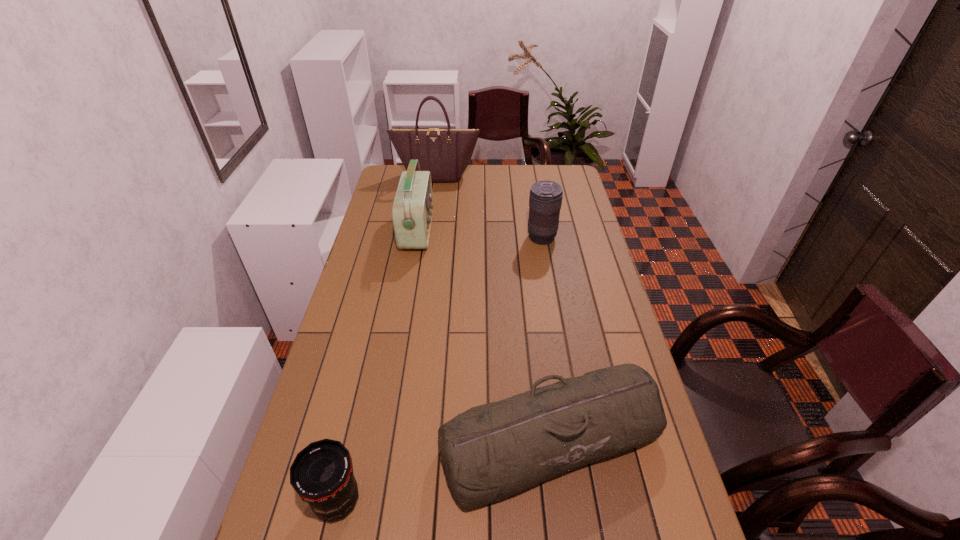
The height and width of the screenshot is (540, 960). I want to click on duffel bag situated at the right edge, so click(492, 451).

Where is `object that is at the far left corner`? The width and height of the screenshot is (960, 540). object that is at the far left corner is located at coordinates (446, 153).

In order to click on free space at the far edge in this screenshot , I will do `click(531, 168)`.

The image size is (960, 540). In the image, there is a desktop. In order to click on free region at the left edge in this screenshot , I will do `click(359, 271)`.

At what (x,y) coordinates should I click in order to perform the action: click on vacant space at the right edge. Please return your answer as a coordinate pair (x, y). This screenshot has width=960, height=540. Looking at the image, I should click on tap(627, 492).

You are a GUI agent. You are given a task and a screenshot of the screen. Output one action in this format:
    pyautogui.click(x=<x>, y=<y>)
    Task: Click on the vacant space at the far left corner of the desktop
    This screenshot has height=540, width=960.
    Given the screenshot: What is the action you would take?
    pyautogui.click(x=385, y=174)

In the image, there is a desktop. Identify the location of vacant area at the far right corner. (564, 184).

Find the location of a particular element. This screenshot has width=960, height=540. vacant space that's between the right telephoto lens and the duffel bag is located at coordinates (546, 339).

This screenshot has width=960, height=540. Identify the location of free space that is in between the duffel bag and the taller telephoto lens. (546, 339).

The width and height of the screenshot is (960, 540). Identify the location of vacant space that is in between the shorter telephoto lens and the farthest object. (387, 338).